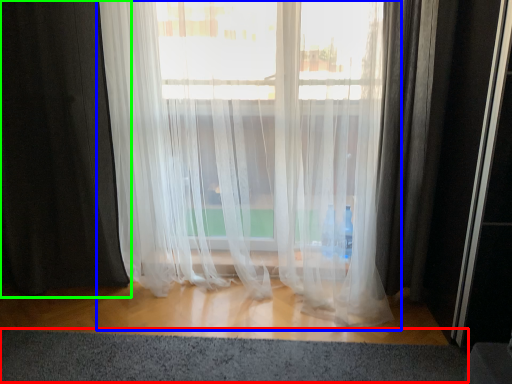
Question: Which is nearer to the gray (highlighted by a red box)? curtain (highlighted by a blue box) or curtain (highlighted by a green box).

Choices:
 (A) curtain
 (B) curtain

Answer: (A)